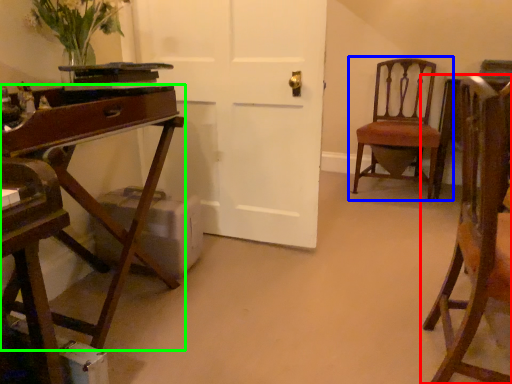
Question: Considering the real-world distances, which object is farthest from chair (highlighted by a red box)? chair (highlighted by a blue box) or desk (highlighted by a green box)?

Choices:
 (A) chair
 (B) desk

Answer: (A)